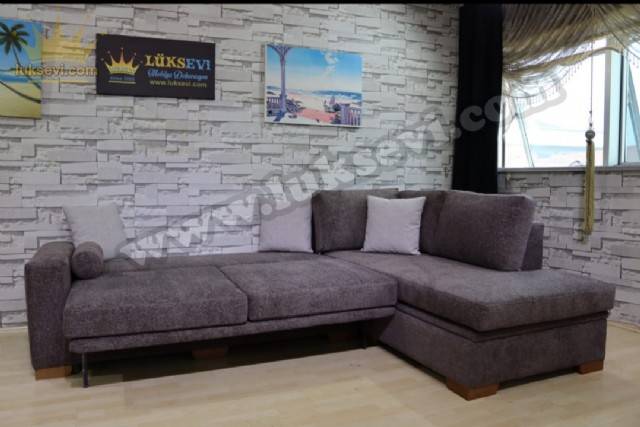
The image size is (640, 427). In order to click on window in this screenshot , I will do `click(532, 112)`.